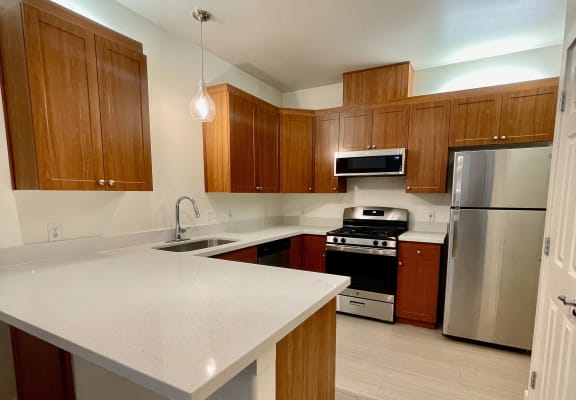
Where is `micorwave`? micorwave is located at coordinates [367, 165].